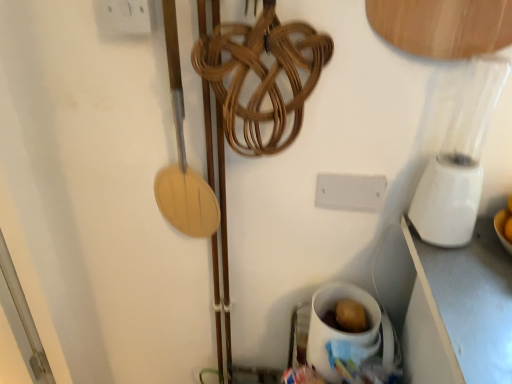
What do you see at coordinates (459, 159) in the screenshot? Image resolution: width=512 pixels, height=384 pixels. I see `white plastic blender at right` at bounding box center [459, 159].

You are a GUI agent. You are given a task and a screenshot of the screen. Output one action in this format:
    pyautogui.click(x=<x>, y=<y>)
    Task: Click on the white plastic blender at right
    The height and width of the screenshot is (384, 512).
    Given the screenshot: What is the action you would take?
    pyautogui.click(x=459, y=159)

Is white plastic blender at right taller or shorter than white plastic electric outlet at upper left?

white plastic blender at right is taller than white plastic electric outlet at upper left.

Image resolution: width=512 pixels, height=384 pixels. I want to click on electric outlet on the left of white plastic blender at right, so click(x=126, y=16).

Is point (469, 223) closer to camera compared to point (112, 14)?

That is False.

Between white plastic electric outlet at upper left and white ceramic mug at lower right, which one has less height?

Standing shorter between the two is white plastic electric outlet at upper left.

Which is correct: white plastic electric outlet at upper left is inside white ceramic mug at lower right, or outside of it?

white plastic electric outlet at upper left is located beyond the bounds of white ceramic mug at lower right.

Can you confirm if white plastic electric outlet at upper left is wider than white ceramic mug at lower right?

In fact, white plastic electric outlet at upper left might be narrower than white ceramic mug at lower right.

From a real-world perspective, which is physically below, white plastic electric outlet at upper left or white ceramic mug at lower right?

white ceramic mug at lower right, from a real-world perspective.

In the image, is white plastic electric outlet at upper left positioned in front of or behind white plastic blender at right?

white plastic electric outlet at upper left is behind white plastic blender at right.

What's the angular difference between white plastic electric outlet at upper left and white plastic blender at right's facing directions?

0.00116 degrees separate the facing orientations of white plastic electric outlet at upper left and white plastic blender at right.

Which of these two, white plastic electric outlet at upper left or white plastic blender at right, is smaller?

Smaller between the two is white plastic electric outlet at upper left.

Is white plastic electric outlet at upper left aimed at white plastic blender at right?

No, white plastic electric outlet at upper left does not turn towards white plastic blender at right.

Does white plastic blender at right come in front of white ceramic mug at lower right?

Yes, white plastic blender at right is closer to the camera.

Can you confirm if white plastic blender at right is thinner than white ceramic mug at lower right?

Yes, white plastic blender at right is thinner than white ceramic mug at lower right.

Image resolution: width=512 pixels, height=384 pixels. I want to click on coffee cup that appears below the white plastic blender at right (from a real-world perspective), so click(340, 331).

From the image's perspective, is white ceramic mug at lower right located above white plastic electric outlet at upper left?

Incorrect, from the image's perspective, white ceramic mug at lower right is lower than white plastic electric outlet at upper left.

Does white ceramic mug at lower right have a smaller size compared to white plastic electric outlet at upper left?

No, white ceramic mug at lower right is not smaller than white plastic electric outlet at upper left.

Does point (320, 296) come in front of point (101, 3)?

No, it is behind (101, 3).

Is white ceramic mug at lower right not inside white plastic electric outlet at upper left?

Indeed, white ceramic mug at lower right is completely outside white plastic electric outlet at upper left.

Does point (329, 286) come farther from viewer compared to point (499, 75)?

Yes, it is behind point (499, 75).

This screenshot has height=384, width=512. Identify the location of blender above the white ceramic mug at lower right (from a real-world perspective). (459, 159).

Between white ceramic mug at lower right and white plastic blender at right, which one has smaller size?

Smaller between the two is white ceramic mug at lower right.

Could you tell me if white ceramic mug at lower right is turned towards white plastic blender at right?

No.

Identify the location of blender directly beneath the white plastic electric outlet at upper left (from a real-world perspective). Image resolution: width=512 pixels, height=384 pixels. (459, 159).

Locate an element on the screen. The width and height of the screenshot is (512, 384). electric outlet above the white ceramic mug at lower right (from a real-world perspective) is located at coordinates (126, 16).

Looking at the image, which one is located closer to white plastic electric outlet at upper left, white plastic blender at right or white ceramic mug at lower right?

white plastic blender at right lies closer to white plastic electric outlet at upper left than the other object.

Which object lies further to the anchor point white plastic blender at right, white plastic electric outlet at upper left or white ceramic mug at lower right?

white plastic electric outlet at upper left lies further to white plastic blender at right than the other object.

Based on their spatial positions, is white ceramic mug at lower right or white plastic blender at right closer to white plastic electric outlet at upper left?

white plastic blender at right.

Looking at the image, which one is located closer to white ceramic mug at lower right, white plastic blender at right or white plastic electric outlet at upper left?

white plastic blender at right is closer to white ceramic mug at lower right.

From the image, which object appears to be nearer to white ceramic mug at lower right, white plastic electric outlet at upper left or white plastic blender at right?

Based on the image, white plastic blender at right appears to be nearer to white ceramic mug at lower right.

Based on their spatial positions, is white ceramic mug at lower right or white plastic electric outlet at upper left further from white plastic blender at right?

Among the two, white plastic electric outlet at upper left is located further to white plastic blender at right.

Identify the location of blender that lies between white plastic electric outlet at upper left and white ceramic mug at lower right from top to bottom. (459, 159).